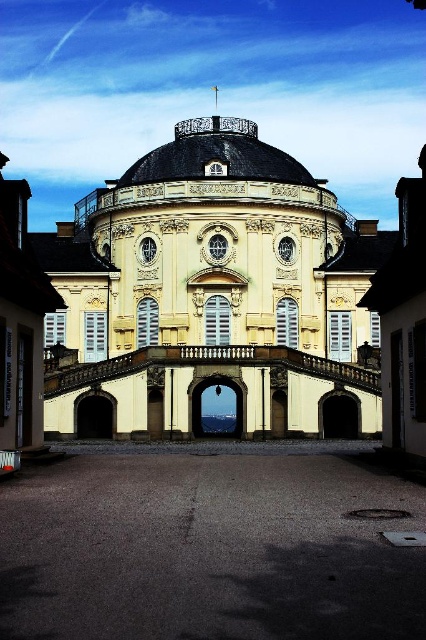
Question: Which object is farther from the camera taking this photo?

Choices:
 (A) gray asphalt at center
 (B) beige stucco palace at center

Answer: (B)

Question: In this image, where is beige stucco palace at center located relative to gray asphalt at center?

Choices:
 (A) left
 (B) right

Answer: (A)

Question: Does beige stucco palace at center appear on the right side of gray asphalt at center?

Choices:
 (A) no
 (B) yes

Answer: (A)

Question: Considering the relative positions of beige stucco palace at center and gray asphalt at center in the image provided, where is beige stucco palace at center located with respect to gray asphalt at center?

Choices:
 (A) below
 (B) above

Answer: (B)